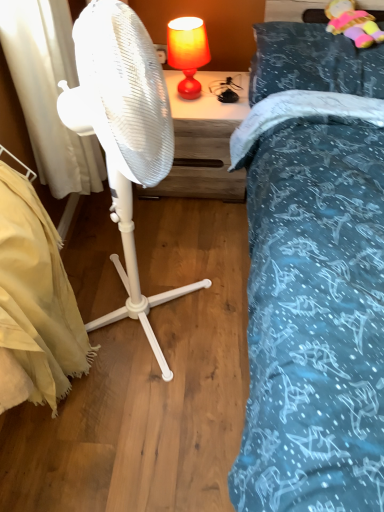
Identify the location of free space above wooden nightstand at center (from a real-world perspective). This screenshot has height=512, width=384. (213, 98).